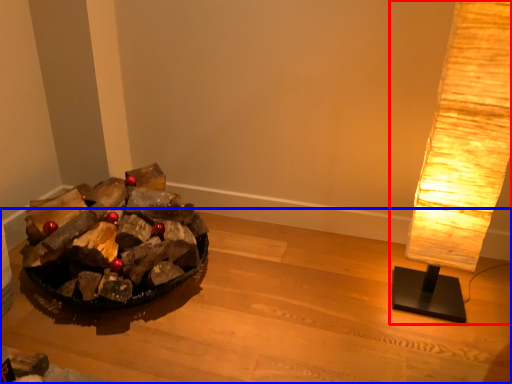
Question: Which object is closer to the camera taking this photo, lamp (highlighted by a red box) or furniture (highlighted by a blue box)?

Choices:
 (A) lamp
 (B) furniture

Answer: (B)